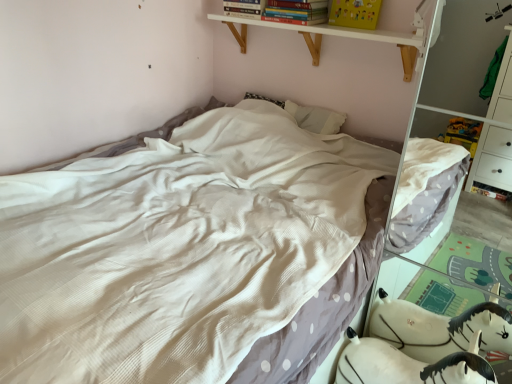
Question: Looking at their shapes, would you say white textured bed at center is wider or thinner than hardcover book at upper center, which appears as the first book when viewed from the left?

Choices:
 (A) thin
 (B) wide

Answer: (B)

Question: Relative to hardcover book at upper center, which appears as the first book when viewed from the left, is white textured bed at center in front or behind?

Choices:
 (A) behind
 (B) front

Answer: (B)

Question: Which is nearer to the white wood shelf at upper center?

Choices:
 (A) white textured bed at center
 (B) hardcover book at upper center, which appears as the first book when viewed from the left
 (C) hardcover book at upper center, the 1th book viewed from the right
 (D) white plush toy at lower right

Answer: (C)

Question: Which object is the farthest from the hardcover book at upper center, placed as the 2th book when sorted from left to right?

Choices:
 (A) hardcover book at upper center, the second book viewed from the right
 (B) white wood shelf at upper center
 (C) white textured bed at center
 (D) white plush toy at lower right

Answer: (D)